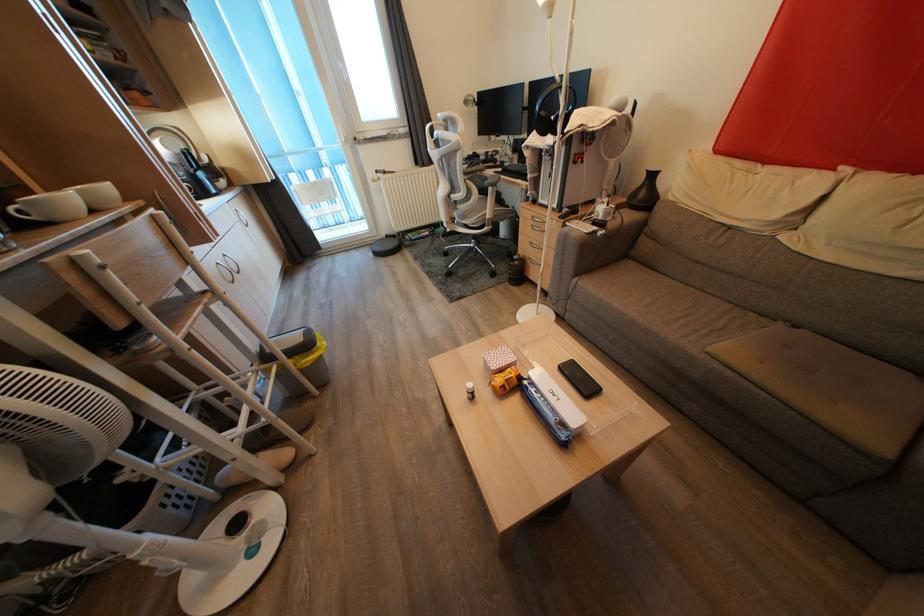
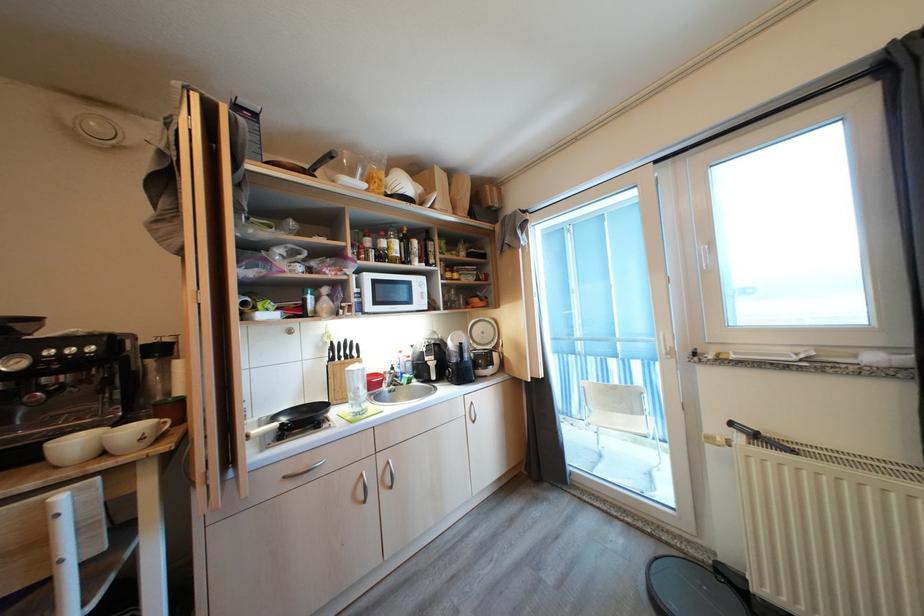
Find the pixel in the second image that matches (x=388, y=177) in the first image.

(760, 440)